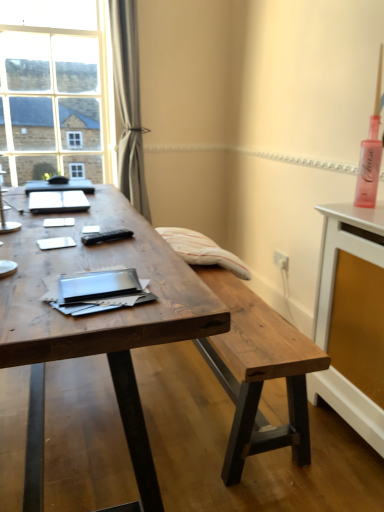
The height and width of the screenshot is (512, 384). Identify the location of free point below wooden desk at center (from a real-world perspective). (62, 428).